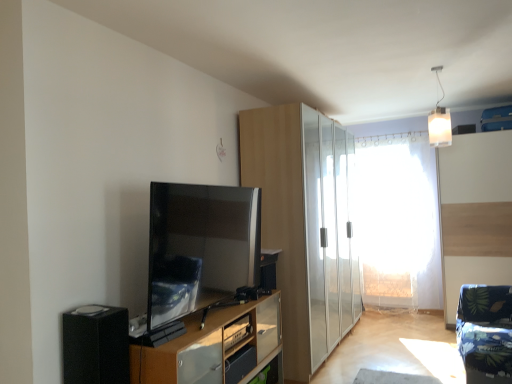
Question: Considering the relative sizes of light wood cabinet at center and transparent plastic curtain at center in the image provided, is light wood cabinet at center taller than transparent plastic curtain at center?

Choices:
 (A) no
 (B) yes

Answer: (B)

Question: Does light wood cabinet at center come behind transparent plastic curtain at center?

Choices:
 (A) yes
 (B) no

Answer: (B)

Question: Is light wood cabinet at center facing towards transparent plastic curtain at center?

Choices:
 (A) no
 (B) yes

Answer: (A)

Question: Can you confirm if light wood cabinet at center is bigger than transparent plastic curtain at center?

Choices:
 (A) no
 (B) yes

Answer: (B)

Question: Can you confirm if light wood cabinet at center is positioned to the left of transparent plastic curtain at center?

Choices:
 (A) yes
 (B) no

Answer: (A)

Question: In the image, is white frosted glass pendant light at upper right positioned in front of or behind satin black tv at center?

Choices:
 (A) front
 (B) behind

Answer: (B)

Question: Visually, is white frosted glass pendant light at upper right positioned to the left or to the right of satin black tv at center?

Choices:
 (A) left
 (B) right

Answer: (B)

Question: In terms of size, does white frosted glass pendant light at upper right appear bigger or smaller than satin black tv at center?

Choices:
 (A) big
 (B) small

Answer: (B)

Question: From their relative heights in the image, would you say white frosted glass pendant light at upper right is taller or shorter than satin black tv at center?

Choices:
 (A) tall
 (B) short

Answer: (B)

Question: From the image's perspective, relative to transparent plastic curtain at center, is satin black tv at center above or below?

Choices:
 (A) above
 (B) below

Answer: (A)

Question: Considering the positions of satin black tv at center and transparent plastic curtain at center in the image, is satin black tv at center bigger or smaller than transparent plastic curtain at center?

Choices:
 (A) small
 (B) big

Answer: (A)

Question: Relative to transparent plastic curtain at center, is satin black tv at center in front or behind?

Choices:
 (A) front
 (B) behind

Answer: (A)

Question: From their relative heights in the image, would you say satin black tv at center is taller or shorter than transparent plastic curtain at center?

Choices:
 (A) tall
 (B) short

Answer: (B)

Question: Is point (201, 337) positioned closer to the camera than point (240, 344)?

Choices:
 (A) closer
 (B) farther

Answer: (A)

Question: Is satin black tv at center to the left or to the right of wooden cabinet at lower center in the image?

Choices:
 (A) right
 (B) left

Answer: (A)